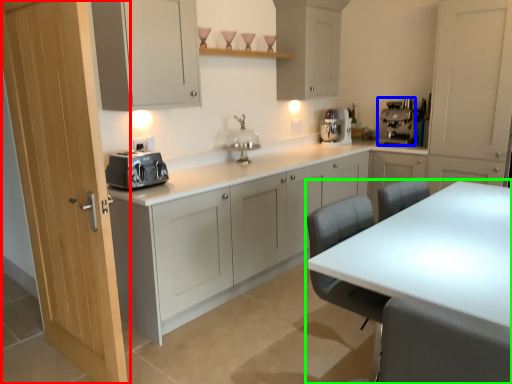
Question: Which is farther away from door (highlighted by a red box)? coffee machine (highlighted by a blue box) or table (highlighted by a green box)?

Choices:
 (A) coffee machine
 (B) table

Answer: (A)